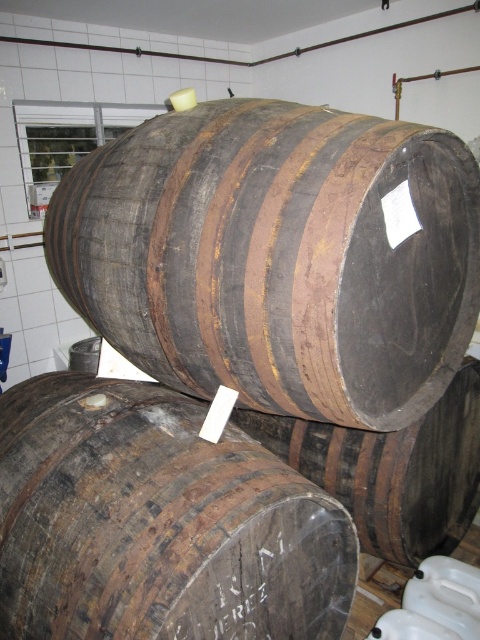
Question: Which object is closer to the camera taking this photo?

Choices:
 (A) rusty wood barrel at center
 (B) dark brown wood barrel at center

Answer: (A)

Question: Does rusty wood barrel at center have a lesser width compared to dark brown wood barrel at center?

Choices:
 (A) yes
 (B) no

Answer: (A)

Question: Which of the following is the closest to the observer?

Choices:
 (A) (107, 435)
 (B) (427, 140)
 (C) (416, 476)

Answer: (B)

Question: Which of the following is the closest to the observer?

Choices:
 (A) rusty wood barrel at center
 (B) dark brown wooden barrel at center

Answer: (B)

Question: Where is dark brown wooden barrel at center located in relation to rusty wood barrel at center in the image?

Choices:
 (A) below
 (B) above

Answer: (B)

Question: Is dark brown wooden barrel at center above rusty wood barrel at center?

Choices:
 (A) no
 (B) yes

Answer: (B)